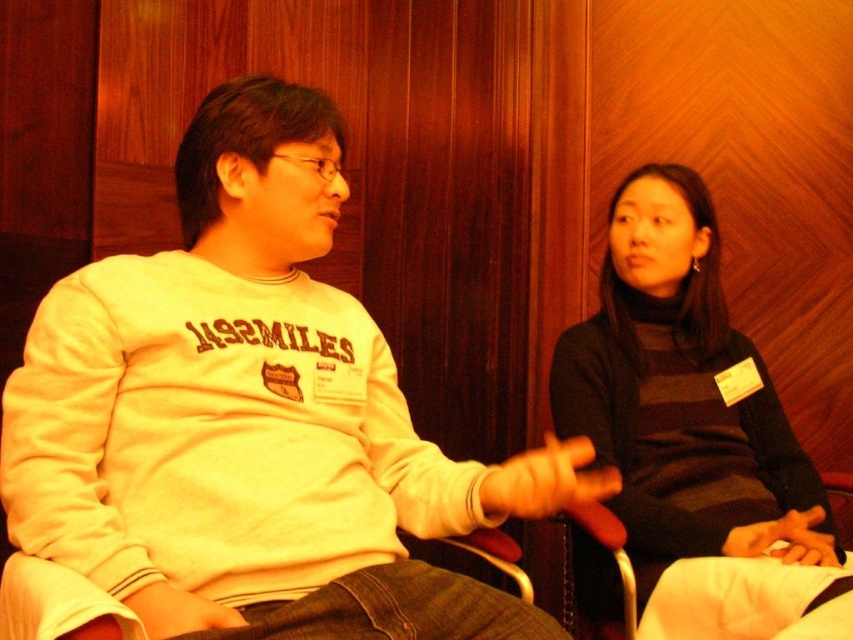
Is white fleece sweatshirt at center smaller than dark gray sweater at center?

Actually, white fleece sweatshirt at center might be larger than dark gray sweater at center.

Does point (306, 592) come behind point (686, 388)?

That is False.

Is point (22, 372) closer to viewer compared to point (778, 413)?

That is True.

This screenshot has width=853, height=640. I want to click on white fleece sweatshirt at center, so click(252, 419).